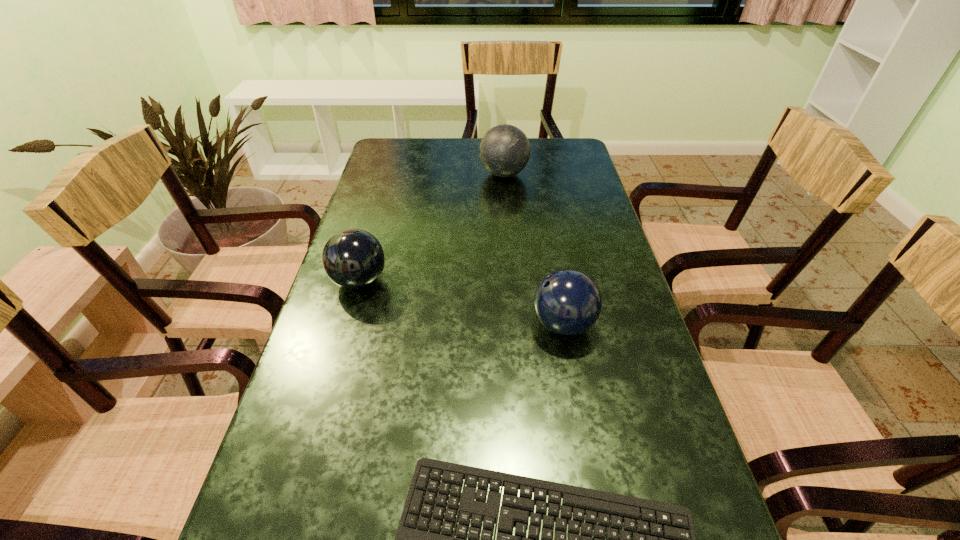
Locate an element on the screen. vacant space located on the surface of the nearest bowling ball near the finger holes is located at coordinates (469, 325).

The height and width of the screenshot is (540, 960). Find the location of `object positioned at the far edge`. object positioned at the far edge is located at coordinates (504, 151).

Locate an element on the screen. This screenshot has width=960, height=540. object that is at the left edge is located at coordinates (352, 258).

Locate an element on the screen. The image size is (960, 540). object that is at the right edge is located at coordinates (567, 302).

Identify the location of free region at the far edge of the desktop. Image resolution: width=960 pixels, height=540 pixels. (461, 165).

Where is `free region at the left edge of the desktop`? Image resolution: width=960 pixels, height=540 pixels. free region at the left edge of the desktop is located at coordinates (368, 224).

Identify the location of free region at the right edge. The height and width of the screenshot is (540, 960). (705, 512).

Where is `vacant space at the far right corner`? This screenshot has height=540, width=960. vacant space at the far right corner is located at coordinates (565, 143).

Identify the location of vacant space that's between the farthest object and the leftmost bowling ball. (432, 227).

This screenshot has height=540, width=960. I want to click on vacant area that lies between the second nearest bowling ball and the farthest bowling ball, so click(x=432, y=227).